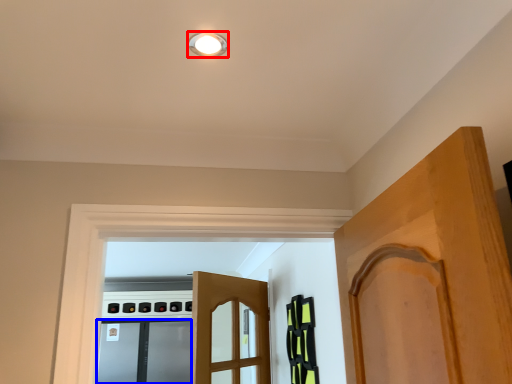
Question: Which of the following is the closest to the observer, light fixture (highlighted by a red box) or screen door (highlighted by a blue box)?

Choices:
 (A) light fixture
 (B) screen door

Answer: (A)